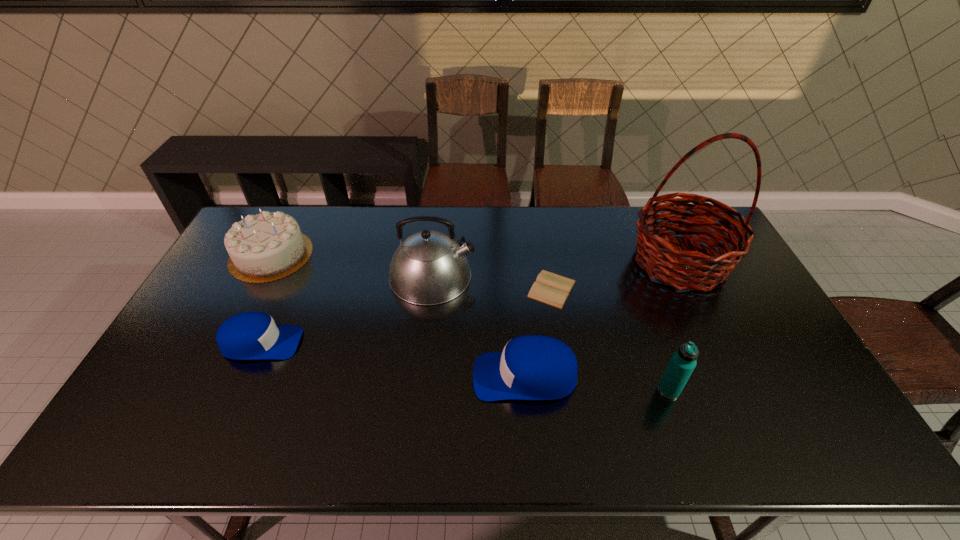
Image resolution: width=960 pixels, height=540 pixels. I want to click on the second shortest object, so click(250, 335).

You are a GUI agent. You are given a task and a screenshot of the screen. Output one action in this format:
    pyautogui.click(x=<x>, y=<y>)
    Task: Click on the shorter baseball cap
    This screenshot has height=540, width=960.
    Given the screenshot: What is the action you would take?
    pyautogui.click(x=250, y=335)

Locate an element on the screen. the fifth tallest object is located at coordinates (533, 367).

Locate an element on the screen. The image size is (960, 540). the right baseball cap is located at coordinates (533, 367).

Locate an element on the screen. The image size is (960, 540). basket is located at coordinates (683, 269).

At what (x,y) coordinates should I click in order to perform the action: click on kettle. Please return your answer as a coordinate pair (x, y). The width and height of the screenshot is (960, 540). Looking at the image, I should click on (428, 268).

Image resolution: width=960 pixels, height=540 pixels. Identify the location of the fourth shortest object. (268, 246).

The image size is (960, 540). What are the coordinates of `the shortest object` in the screenshot? It's located at (552, 289).

Where is `the third tallest object`? the third tallest object is located at coordinates (682, 363).

Find the location of a particular element. The image size is (960, 540). vacant space located 0.380m on the front-facing side of the shorter baseball cap is located at coordinates (436, 343).